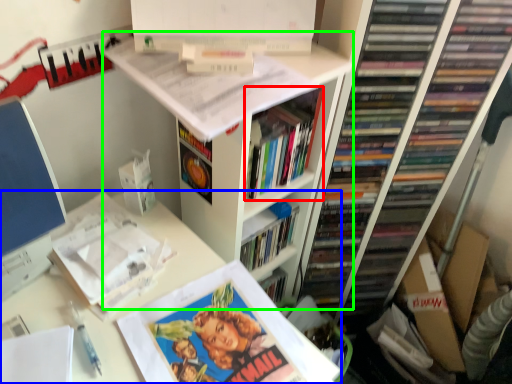
Question: Which is nearer to the book (highlighted by a red box)? computer desk (highlighted by a blue box) or bookshelf (highlighted by a green box).

Choices:
 (A) computer desk
 (B) bookshelf

Answer: (B)